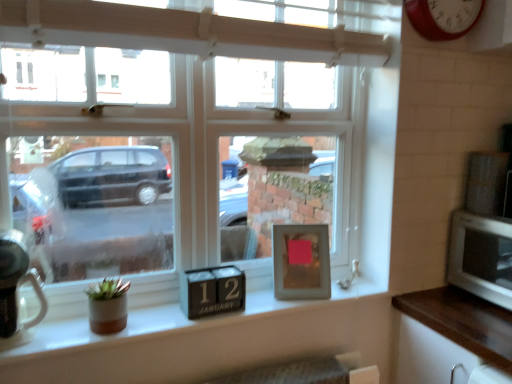
The image size is (512, 384). What do you see at coordinates (463, 321) in the screenshot? I see `brown wood counter top at lower right` at bounding box center [463, 321].

What are the coordinates of `red metallic clock at upper right` in the screenshot? It's located at (443, 17).

Where is `silver metallic microwave at right`? This screenshot has width=512, height=384. silver metallic microwave at right is located at coordinates (481, 257).

You are a GUI agent. You are given a task and a screenshot of the screen. Output one action in this format:
    pyautogui.click(x=<x>, y=<y>)
    Task: Click on the brushed metal kettle at left, the 2th appliance viewed from the back
    The image size is (512, 384).
    Given the screenshot: What is the action you would take?
    pyautogui.click(x=16, y=290)

Can you confirm if red metallic clock at upper right is positioned to the left of silver metallic microwave at right?

Correct, you'll find red metallic clock at upper right to the left of silver metallic microwave at right.

From a real-world perspective, is red metallic clock at upper right located higher than silver metallic microwave at right?

Yes, from a real-world perspective, red metallic clock at upper right is above silver metallic microwave at right.

You are a GUI agent. You are given a task and a screenshot of the screen. Output one action in this format:
    pyautogui.click(x=<x>, y=<y>)
    Task: Click on the microwave behind the red metallic clock at upper right
    This screenshot has height=384, width=512.
    Given the screenshot: What is the action you would take?
    pyautogui.click(x=481, y=257)

Could red metallic clock at upper right be considered to be inside white glossy microwave at right, positioned as the first appliance in top-to-bottom order?

That's incorrect, red metallic clock at upper right is not inside white glossy microwave at right, positioned as the first appliance in top-to-bottom order.

Image resolution: width=512 pixels, height=384 pixels. Identify the location of clock that appears on the left of white glossy microwave at right, the second appliance from the left. (443, 17).

Is white glossy microwave at right, the second appliance from the left, positioned far away from red metallic clock at upper right?

Actually, white glossy microwave at right, the second appliance from the left, and red metallic clock at upper right are a little close together.

Is white glossy microwave at right, the 2th appliance when ordered from front to back, aimed at red metallic clock at upper right?

No.

Locate an element on the screen. the 2nd appliance positioned below the red metallic clock at upper right (from the image's perspective) is located at coordinates (16, 290).

Consider the image. From the image's perspective, is brushed metal kettle at left, arranged as the first appliance when ordered from the bottom, beneath red metallic clock at upper right?

Yes.

Between brushed metal kettle at left, which ranks as the 1th appliance in left-to-right order, and red metallic clock at upper right, which one has larger size?

With larger size is red metallic clock at upper right.

Looking at this image, is brushed metal kettle at left, which ranks as the 1th appliance in left-to-right order, not inside red metallic clock at upper right?

Yes.

Is red metallic clock at upper right surrounding clear glass window at center?

That's incorrect, clear glass window at center is not inside red metallic clock at upper right.

Can you confirm if red metallic clock at upper right is positioned to the left of clear glass window at center?

Incorrect, red metallic clock at upper right is not on the left side of clear glass window at center.

Who is bigger, red metallic clock at upper right or clear glass window at center?

Bigger between the two is clear glass window at center.

Are clear glass window at center and white glossy microwave at right, the 2th appliance when ordered from front to back, located far from each other?

No.

Is clear glass window at center positioned beyond the bounds of white glossy microwave at right, the 2th appliance positioned from the bottom?

That's correct, clear glass window at center is outside of white glossy microwave at right, the 2th appliance positioned from the bottom.

Looking at this image, considering the sizes of objects clear glass window at center and white glossy microwave at right, placed as the first appliance when sorted from right to left, in the image provided, who is wider, clear glass window at center or white glossy microwave at right, placed as the first appliance when sorted from right to left,?

clear glass window at center is wider.

From a real-world perspective, which object stands above the other?

clear glass window at center, from a real-world perspective.

What's the angular difference between silver metallic microwave at right and red metallic clock at upper right's facing directions?

91.2 degrees separate the facing orientations of silver metallic microwave at right and red metallic clock at upper right.

Find the location of a particular element. This screenshot has height=384, width=512. microwave to the right of red metallic clock at upper right is located at coordinates (481, 257).

Is point (501, 297) behind point (431, 21)?

Yes, it is.

Who is smaller, silver metallic microwave at right or red metallic clock at upper right?

With smaller size is red metallic clock at upper right.

Is the surface of silver metallic microwave at right in direct contact with clear glass window at center?

No, silver metallic microwave at right is not beside clear glass window at center.

Between silver metallic microwave at right and clear glass window at center, which one is positioned behind?

Positioned behind is silver metallic microwave at right.

Would you say silver metallic microwave at right contains clear glass window at center?

Actually, clear glass window at center is outside silver metallic microwave at right.

In order to click on clock that is above the silver metallic microwave at right (from a real-world perspective) in this screenshot , I will do `click(443, 17)`.

Where is `appliance on the right of red metallic clock at upper right`? The image size is (512, 384). appliance on the right of red metallic clock at upper right is located at coordinates (486, 183).

Estimate the real-world distances between objects in this image. Which object is closer to red metallic clock at upper right, white glossy microwave at right, which appears as the 1th appliance when viewed from the back, or brown wood counter top at lower right?

white glossy microwave at right, which appears as the 1th appliance when viewed from the back, is positioned closer to the anchor red metallic clock at upper right.

Looking at the image, which one is located closer to brown wood counter top at lower right, brushed metal kettle at left, which ranks as the 2th appliance in top-to-bottom order, or red metallic clock at upper right?

Based on the image, red metallic clock at upper right appears to be nearer to brown wood counter top at lower right.

When comparing their distances from clear glass window at center, does silver metallic microwave at right or red metallic clock at upper right seem closer?

silver metallic microwave at right.

Based on their spatial positions, is silver metallic microwave at right or brown wood counter top at lower right further from red metallic clock at upper right?

Based on the image, brown wood counter top at lower right appears to be further to red metallic clock at upper right.

Looking at the image, which one is located closer to silver metallic microwave at right, brown wood counter top at lower right or white glossy microwave at right, the second appliance from the left?

Based on the image, brown wood counter top at lower right appears to be nearer to silver metallic microwave at right.

Based on their spatial positions, is red metallic clock at upper right or white glossy microwave at right, positioned as the first appliance in top-to-bottom order, further from clear glass window at center?

Among the two, white glossy microwave at right, positioned as the first appliance in top-to-bottom order, is located further to clear glass window at center.

Considering their positions, is red metallic clock at upper right positioned further to white glossy microwave at right, positioned as the first appliance in top-to-bottom order, than silver metallic microwave at right?

red metallic clock at upper right.

Based on their spatial positions, is brown wood counter top at lower right or red metallic clock at upper right further from brushed metal kettle at left, which ranks as the 2th appliance in top-to-bottom order?

red metallic clock at upper right.

Identify the location of clock situated between clear glass window at center and white glossy microwave at right, the 2th appliance positioned from the bottom, from left to right. The height and width of the screenshot is (384, 512). (443, 17).

Image resolution: width=512 pixels, height=384 pixels. In order to click on counter top between clear glass window at center and silver metallic microwave at right in the horizontal direction in this screenshot , I will do `click(463, 321)`.

In order to click on window between brushed metal kettle at left, arranged as the first appliance when ordered from the bottom, and white glossy microwave at right, the second appliance from the left, in the horizontal direction in this screenshot , I will do `click(177, 143)`.

This screenshot has height=384, width=512. I want to click on clock between brushed metal kettle at left, placed as the 1th appliance when sorted from front to back, and brown wood counter top at lower right from left to right, so click(x=443, y=17).